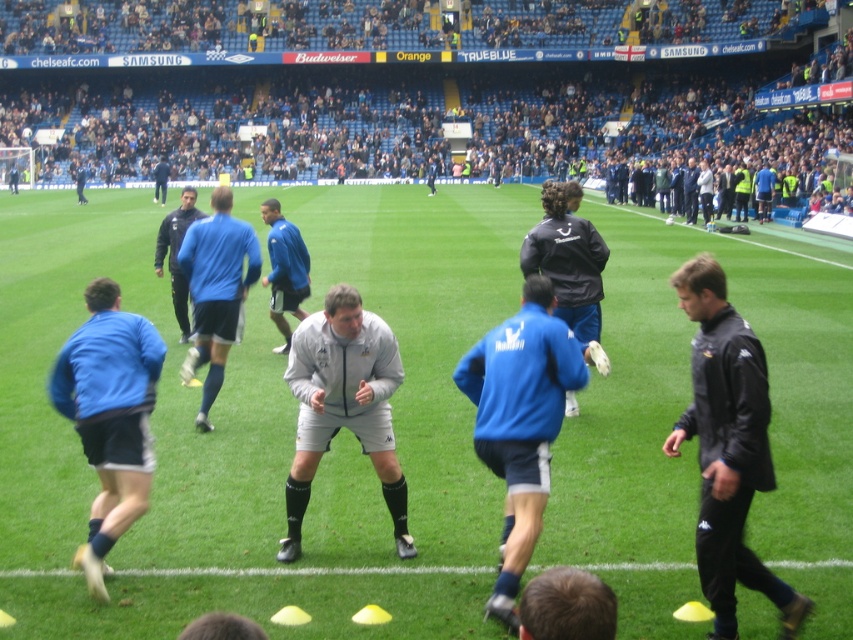
In the scene shown: You are a photographer at the soccer training session. You want to take a photo that includes both the black leather jacket at right and the gray fleece jacket at center. Which jacket should you position closer to the bottom of the frame to ensure both are fully visible?

The black leather jacket at right is taller than the gray fleece jacket at center, so to ensure both are fully visible in the photo, position the taller black leather jacket at right closer to the bottom of the frame.

You are a photographer positioned at the edge of the soccer field. You need to capture a photo of both the blue matte jacket at center and the blue matte shorts at center. Which object should you focus on first if you want to include both in the frame without moving the camera?

The blue matte shorts at center should be focused on first because the blue matte jacket at center is positioned to its right side, so by centering the blue matte shorts at center in the frame, the jacket will naturally be included to the right without needing to adjust the camera position.